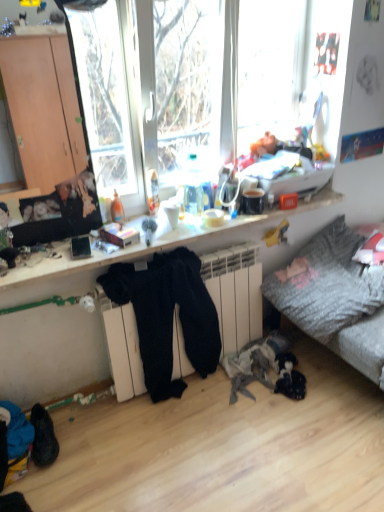
Question: Is black suede shoes at lower left not inside textured gray fabric couch at lower right?

Choices:
 (A) no
 (B) yes

Answer: (B)

Question: From the image's perspective, is black suede shoes at lower left located above textured gray fabric couch at lower right?

Choices:
 (A) yes
 (B) no

Answer: (B)

Question: Would you say textured gray fabric couch at lower right is part of black suede shoes at lower left's contents?

Choices:
 (A) no
 (B) yes

Answer: (A)

Question: Can you confirm if black suede shoes at lower left is positioned to the left of textured gray fabric couch at lower right?

Choices:
 (A) no
 (B) yes

Answer: (B)

Question: Considering the relative sizes of black suede shoes at lower left and textured gray fabric couch at lower right in the image provided, is black suede shoes at lower left bigger than textured gray fabric couch at lower right?

Choices:
 (A) yes
 (B) no

Answer: (B)

Question: Can you confirm if black suede shoes at lower left is positioned to the right of textured gray fabric couch at lower right?

Choices:
 (A) no
 (B) yes

Answer: (A)

Question: From a real-world perspective, is textured gray fabric couch at lower right below wooden desk at center?

Choices:
 (A) yes
 (B) no

Answer: (A)

Question: Is textured gray fabric couch at lower right completely or partially outside of wooden desk at center?

Choices:
 (A) yes
 (B) no

Answer: (A)

Question: Does textured gray fabric couch at lower right come in front of wooden desk at center?

Choices:
 (A) yes
 (B) no

Answer: (B)

Question: Can you confirm if textured gray fabric couch at lower right is smaller than wooden desk at center?

Choices:
 (A) no
 (B) yes

Answer: (A)

Question: Are textured gray fabric couch at lower right and wooden desk at center making contact?

Choices:
 (A) yes
 (B) no

Answer: (B)

Question: Is textured gray fabric couch at lower right bigger than wooden desk at center?

Choices:
 (A) yes
 (B) no

Answer: (A)

Question: From a real-world perspective, is textured gray fabric couch at lower right located beneath black suede shoes at lower left?

Choices:
 (A) no
 (B) yes

Answer: (A)